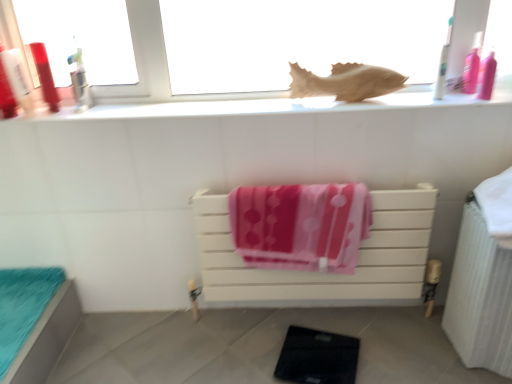
Locate an element on the screen. The width and height of the screenshot is (512, 384). vacant region to the right of teal fabric cushion at lower left, which is the 2th furniture from right to left is located at coordinates (121, 346).